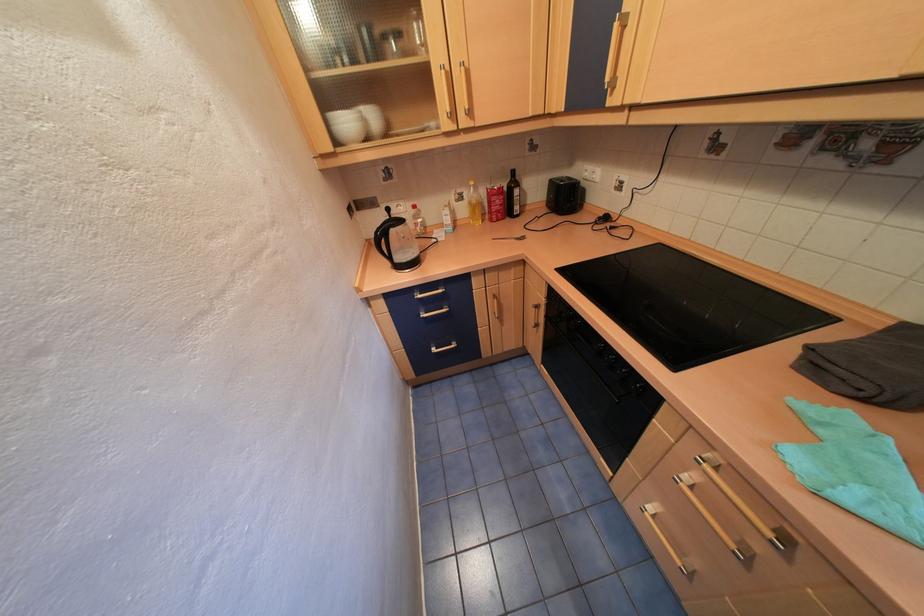
Find where to grasp the clear plastic bottle. Please return your answer as a coordinate pair (x, y).

(473, 204)